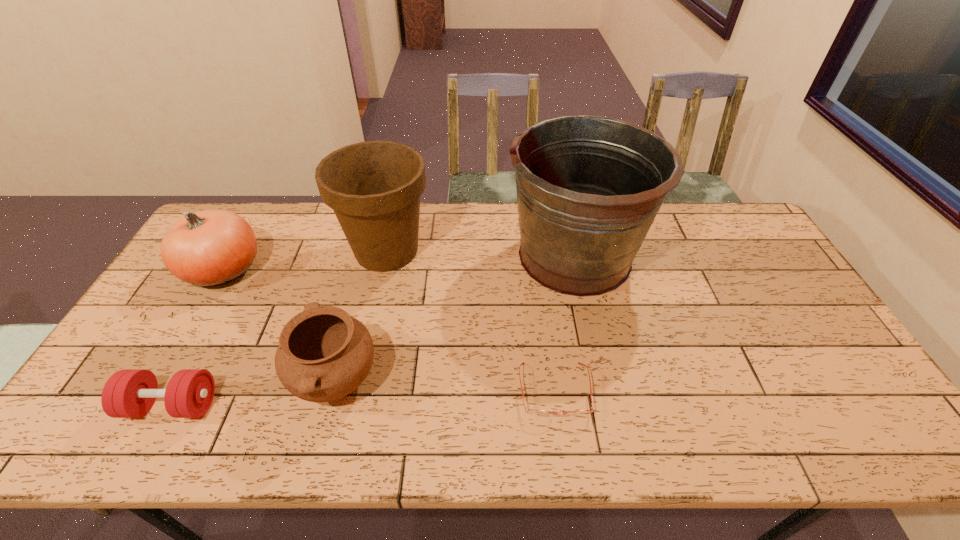
In order to click on unoccupied area between the fifth tallest object and the pottery in this screenshot , I will do `click(253, 393)`.

Locate an element on the screen. unoccupied position between the spectacles and the pumpkin is located at coordinates (389, 330).

The image size is (960, 540). Identify the location of vacant space that is in between the shortest object and the pumpkin. (389, 330).

Find the location of a particular element. free space between the pumpkin and the pottery is located at coordinates (279, 325).

The image size is (960, 540). I want to click on vacant point located between the flowerpot and the second shortest object, so click(279, 328).

Locate an element on the screen. Image resolution: width=960 pixels, height=540 pixels. vacant area between the bucket and the pottery is located at coordinates (455, 318).

Find the location of `the second closest object relative to the dumbbell`. the second closest object relative to the dumbbell is located at coordinates (207, 248).

Select which object appears as the second closest to the flowerpot. Please provide its 2D coordinates. Your answer should be formatted as a tuple, i.e. [(x, y)], where the tuple contains the x and y coordinates of a point satisfying the conditions above.

[(207, 248)]

What are the coordinates of `vacant area in the image that satisfies the following two spatial constraints: 1. on the back side of the fifth tallest object; 2. on the left side of the bucket` in the screenshot? It's located at (252, 256).